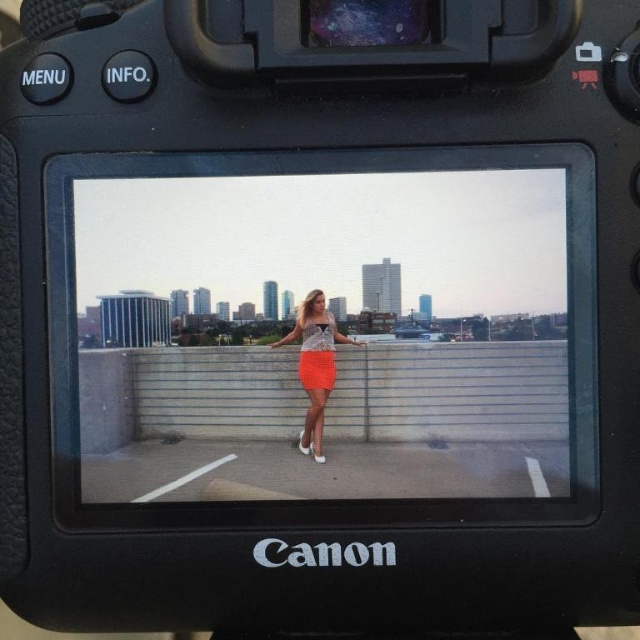
Which is more to the right, orange crochet skirt at center or orange matte dress at center?

Positioned to the right is orange crochet skirt at center.

At what (x,y) coordinates should I click in order to perform the action: click on orange crochet skirt at center. Please return your answer as a coordinate pair (x, y). This screenshot has height=640, width=640. Looking at the image, I should click on (314, 364).